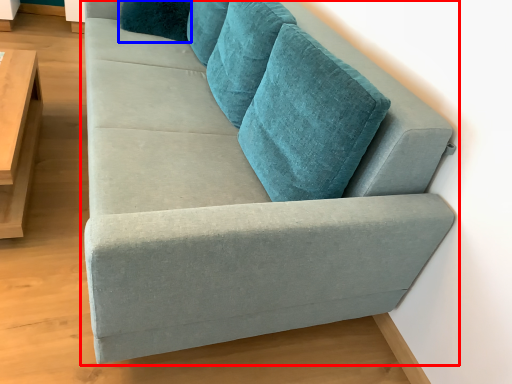
Question: Among these objects, which one is farthest to the camera, studio couch (highlighted by a red box) or pillow (highlighted by a blue box)?

Choices:
 (A) studio couch
 (B) pillow

Answer: (B)